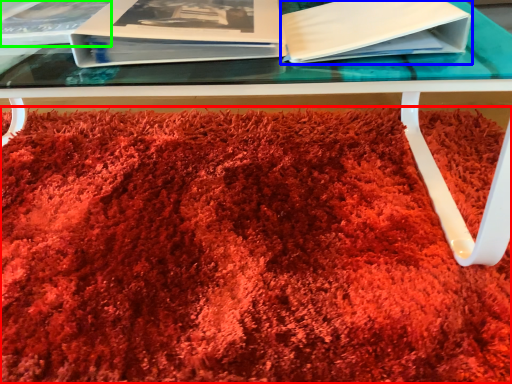
Question: Considering the real-world distances, which object is farthest from blanket (highlighted by a red box)? paperback book (highlighted by a blue box) or album (highlighted by a green box)?

Choices:
 (A) paperback book
 (B) album

Answer: (B)